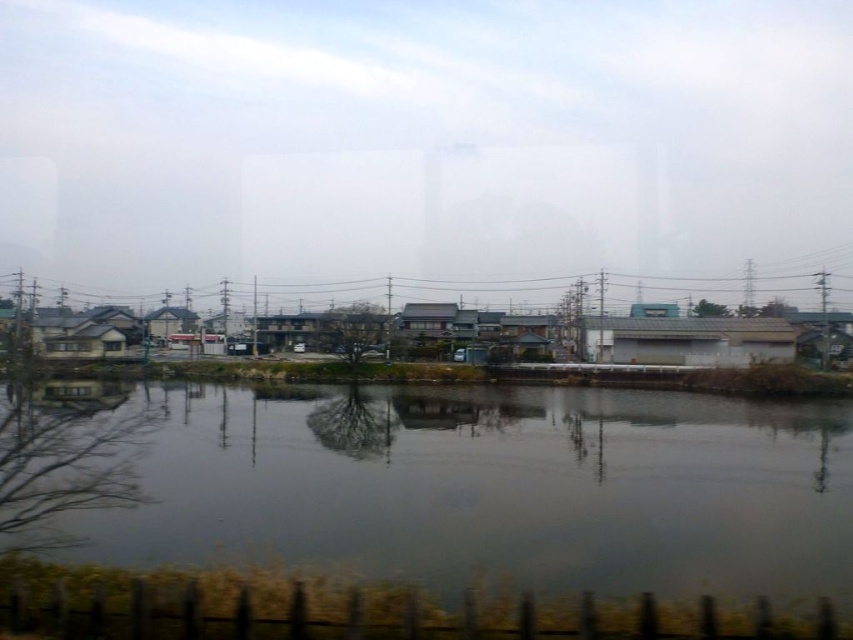
You are standing at the point marked as point (538, 515) in the image. You want to cross the water to reach the buildings on the other side. The bridge closest to you is 50 feet away. Can you safely walk to the bridge without getting wet?

The distance between you and the point marked as point (538, 515) is 63.20 feet. Since the bridge is only 50 feet away, you can walk to the bridge without getting wet as it is closer than your current position to the water.

You are standing at the edge of the dark gray water at center and want to throw a small stone into it. Considering the water is 10.19 meters away, can you accurately throw the stone to hit the water if your maximum throwing distance is 10 meters?

The dark gray water at center is 10.19 meters away from the camera. Since your maximum throwing distance is 10 meters, you cannot accurately throw the stone to hit the water because the distance required is slightly beyond your capability.

You are standing at the edge of the water in the scene. There are two points marked in the image. Which point, point (682, 577) or point (645, 275), is closer to you?

Point (682, 577) is closer to the viewer than point (645, 275).